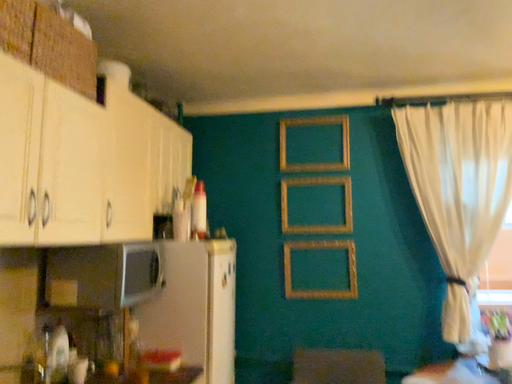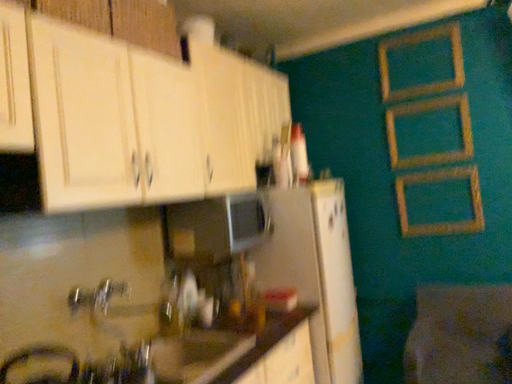
Question: How did the camera likely rotate when shooting the video?

Choices:
 (A) rotated downward
 (B) rotated upward

Answer: (A)